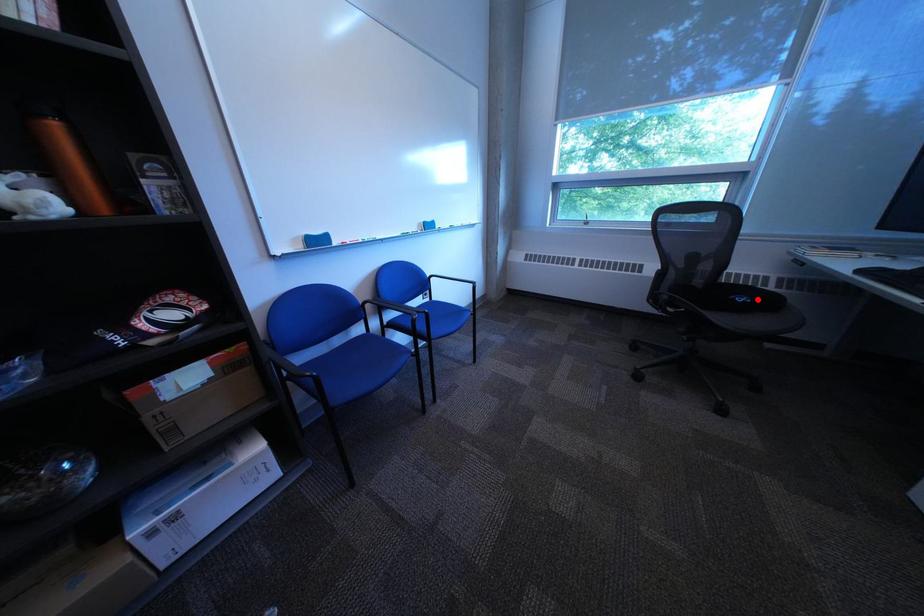
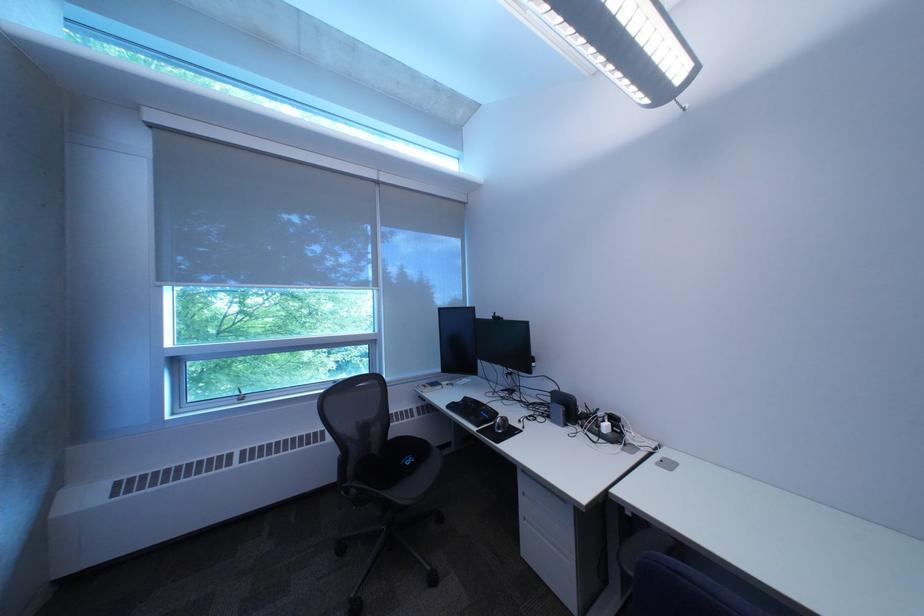
Where in the second image is the point corresponding to the highlighted location from the first image?

(423, 461)